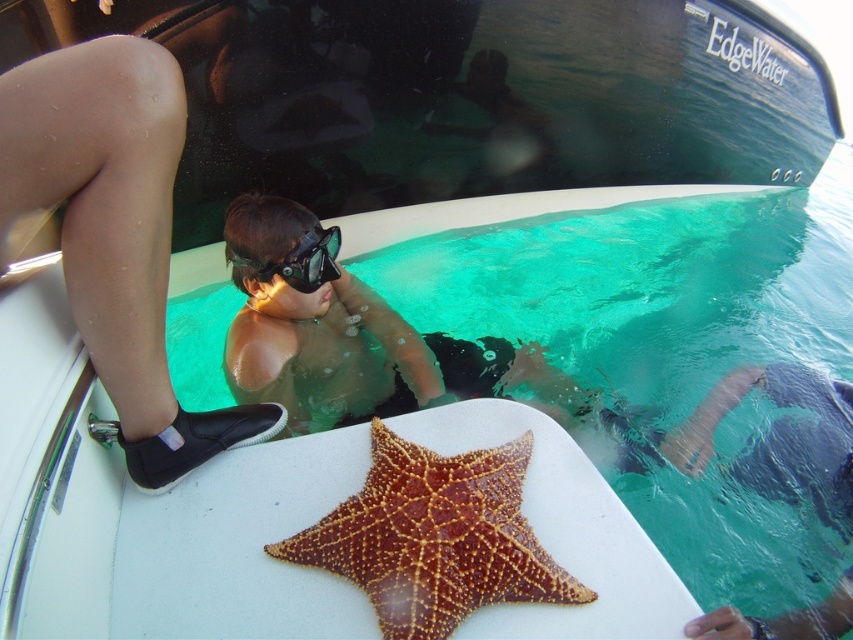
You are a marine biologist examining the objects on the boat. Which object is taller, the brown spiny starfish at center or the black matte goggles at center?

The brown spiny starfish at center is taller than the black matte goggles at center according to the description.

You are standing on the boat named EdgeWater and see the brown spiny starfish at center. If you want to place a small cup exactly 0.1 units to the right of the starfish, what coordinate would you use?

The brown spiny starfish at center is at point (434,538). Adding 0.1 to the x coordinate gives 0.941, so the new coordinate would be (434,602).